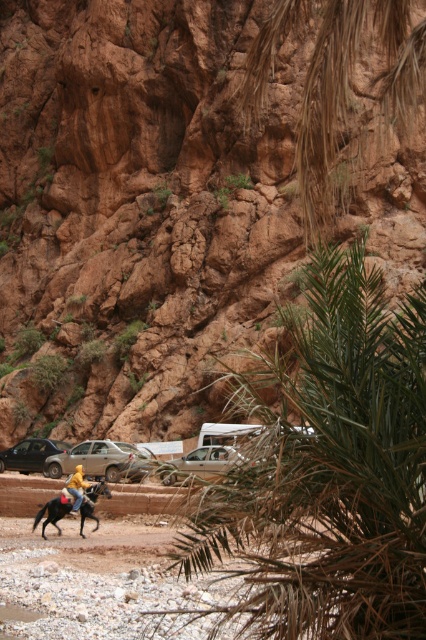
Question: Does silver metallic car at lower left have a smaller size compared to matte black car at left?

Choices:
 (A) no
 (B) yes

Answer: (B)

Question: Can you confirm if silver metallic car at lower left is positioned to the left of yellow matte jacket at center?

Choices:
 (A) no
 (B) yes

Answer: (B)

Question: Which of the following is the closest to the observer?

Choices:
 (A) silver metallic car at center
 (B) matte black car at left

Answer: (A)

Question: Based on their relative distances, which object is nearer to the black glossy horse at lower left?

Choices:
 (A) silver metallic car at center
 (B) silver metallic car at lower left

Answer: (A)

Question: Is the position of brown rough rock at upper center less distant than that of black glossy horse at lower left?

Choices:
 (A) yes
 (B) no

Answer: (B)

Question: Which is farther from the matte black car at left?

Choices:
 (A) yellow matte jacket at center
 (B) silver metallic car at lower left
 (C) black glossy horse at lower left

Answer: (C)